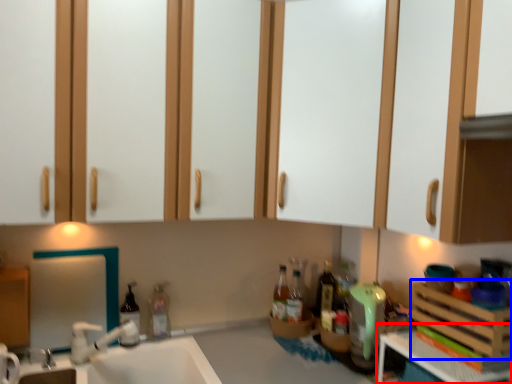
Question: Which point is closer to the camera, counter top (highlighted by a red box) or basket (highlighted by a blue box)?

Choices:
 (A) counter top
 (B) basket

Answer: (A)